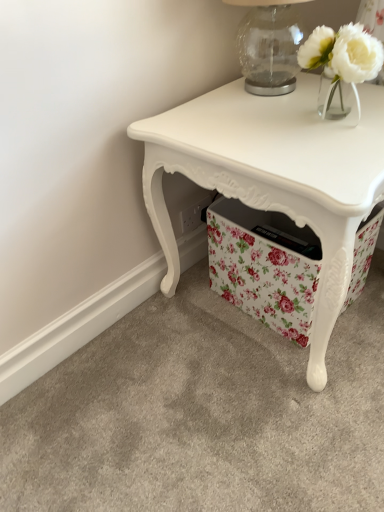
This screenshot has width=384, height=512. I want to click on vacant space in front of floral fabric storage box at lower center, so click(x=296, y=376).